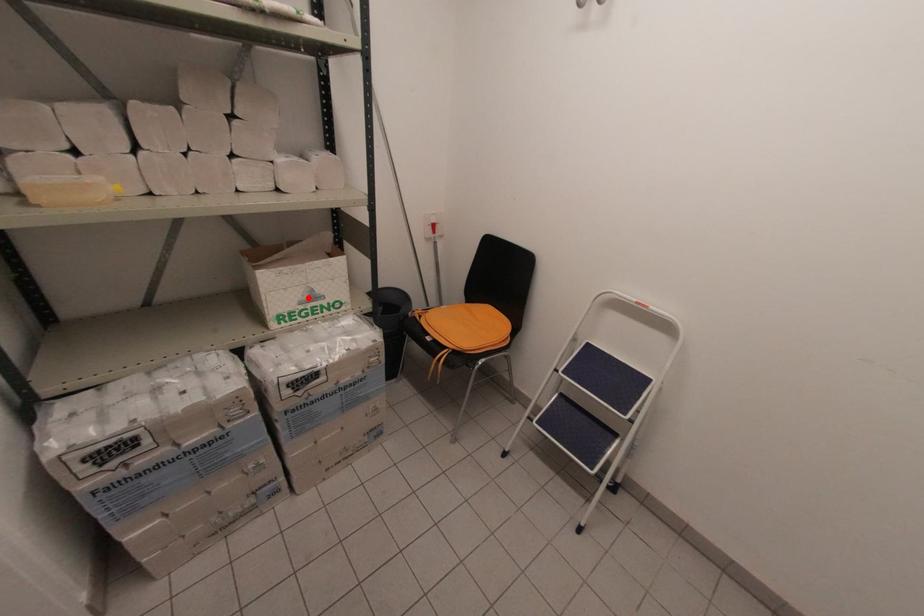
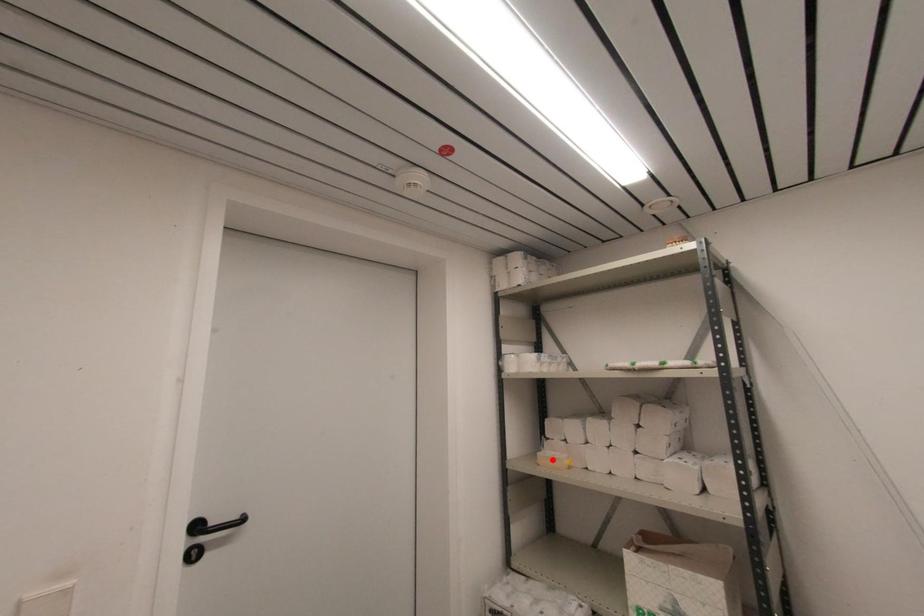
I am providing you with two images of the same scene from different viewpoints. A red point is marked on the first image and another point is marked on the second image. Does the point marked in image1 correspond to the same location as the one in image2?

No